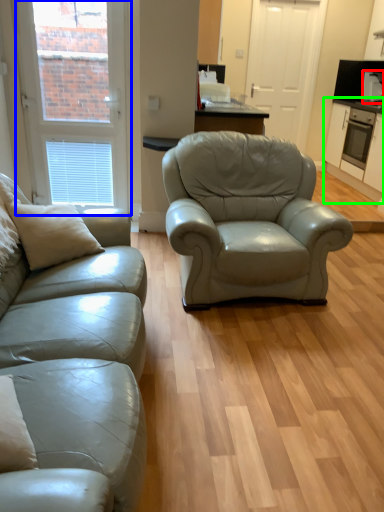
Question: Which object is the farthest from appliance (highlighted by a red box)? Choose among these: window (highlighted by a blue box) or cabinetry (highlighted by a green box).

Choices:
 (A) window
 (B) cabinetry

Answer: (A)